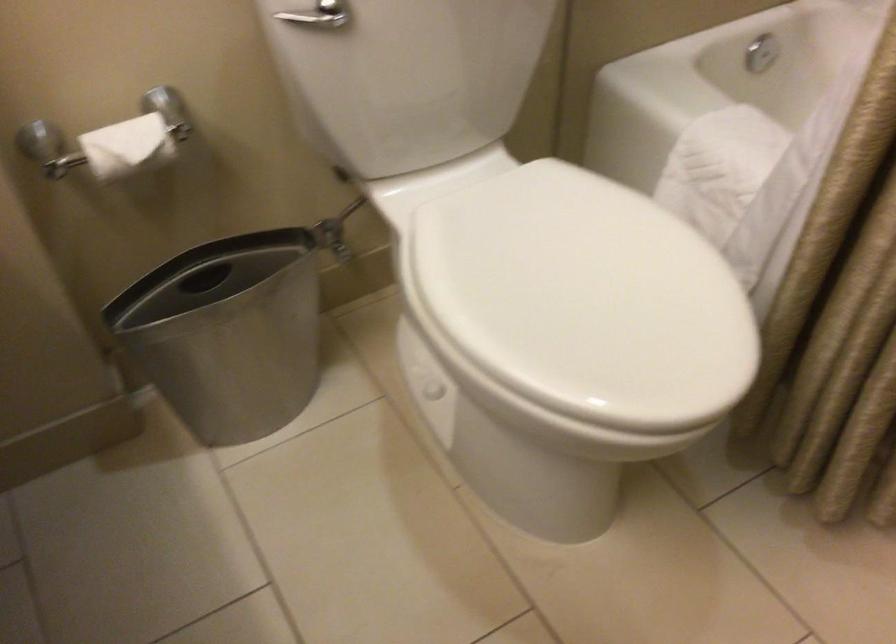
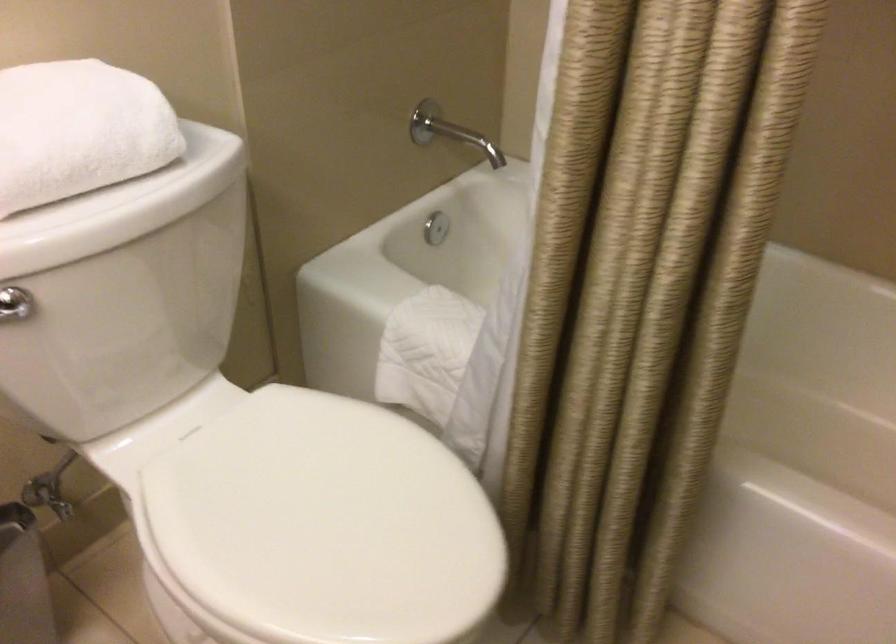
Question: The images are taken continuously from a first-person perspective. In which direction are you moving?

Choices:
 (A) Left
 (B) Right
 (C) Forward
 (D) Backward

Answer: (D)